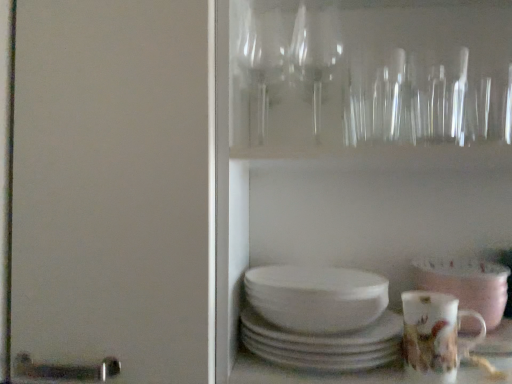
Question: From the image's perspective, would you say white glossy bowl at lower right is positioned over porcelain floral mug at lower right?

Choices:
 (A) yes
 (B) no

Answer: (A)

Question: Is white glossy bowl at lower right aimed at porcelain floral mug at lower right?

Choices:
 (A) no
 (B) yes

Answer: (B)

Question: Is white glossy bowl at lower right shorter than porcelain floral mug at lower right?

Choices:
 (A) yes
 (B) no

Answer: (A)

Question: Is white glossy bowl at lower right not near porcelain floral mug at lower right?

Choices:
 (A) yes
 (B) no

Answer: (B)

Question: Is white glossy bowl at lower right wider than porcelain floral mug at lower right?

Choices:
 (A) no
 (B) yes

Answer: (B)

Question: From a real-world perspective, is white glossy bowl at lower right physically located above or below porcelain floral mug at lower right?

Choices:
 (A) below
 (B) above

Answer: (B)

Question: In the image, is white glossy bowl at lower right positioned in front of or behind porcelain floral mug at lower right?

Choices:
 (A) behind
 (B) front

Answer: (A)

Question: Based on their positions, is white glossy bowl at lower right located to the left or right of porcelain floral mug at lower right?

Choices:
 (A) right
 (B) left

Answer: (A)

Question: Is white glossy bowl at lower right inside the boundaries of porcelain floral mug at lower right, or outside?

Choices:
 (A) inside
 (B) outside

Answer: (B)

Question: From the image's perspective, is white glossy bowl at lower right above or below white glossy plates at center?

Choices:
 (A) above
 (B) below

Answer: (A)

Question: Looking at their shapes, would you say white glossy bowl at lower right is wider or thinner than white glossy plates at center?

Choices:
 (A) thin
 (B) wide

Answer: (A)

Question: Visually, is white glossy bowl at lower right positioned to the left or to the right of white glossy plates at center?

Choices:
 (A) left
 (B) right

Answer: (B)

Question: Which is correct: white glossy bowl at lower right is inside white glossy plates at center, or outside of it?

Choices:
 (A) outside
 (B) inside

Answer: (A)

Question: In the image, is porcelain floral mug at lower right positioned in front of or behind white glossy bowl at lower right?

Choices:
 (A) front
 (B) behind

Answer: (A)

Question: From the image's perspective, relative to white glossy bowl at lower right, is porcelain floral mug at lower right above or below?

Choices:
 (A) below
 (B) above

Answer: (A)